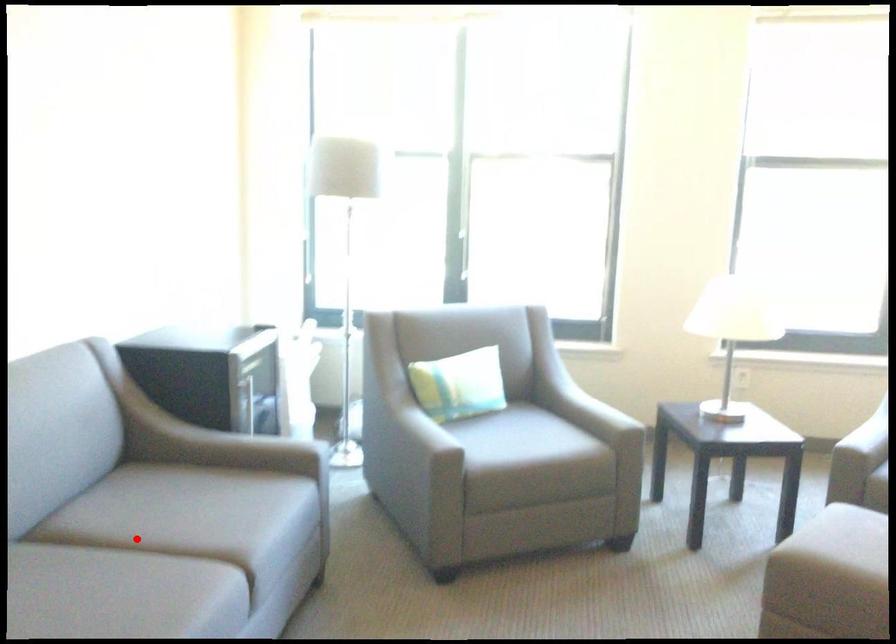
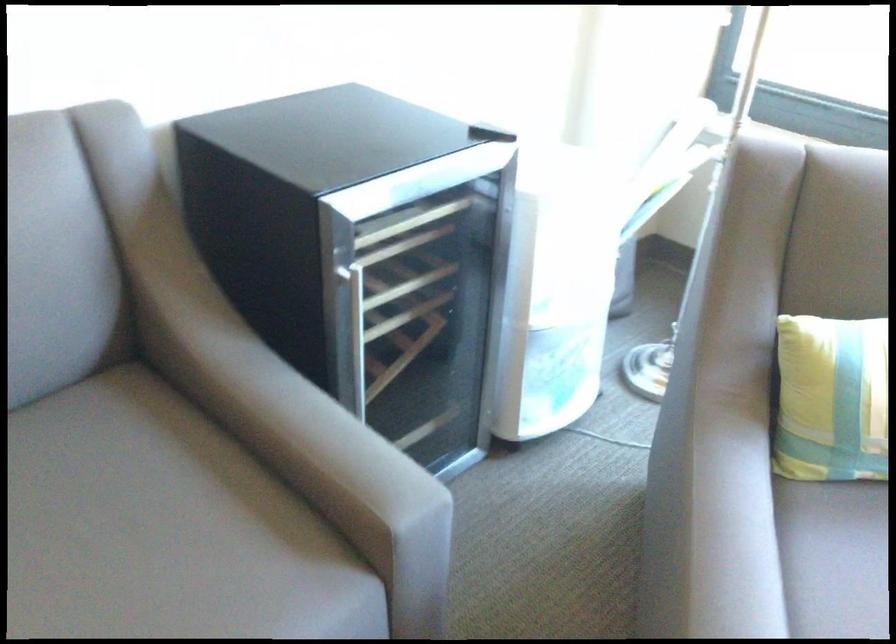
Locate, in the second image, the point that corresponds to the highlighted location in the first image.

(83, 529)